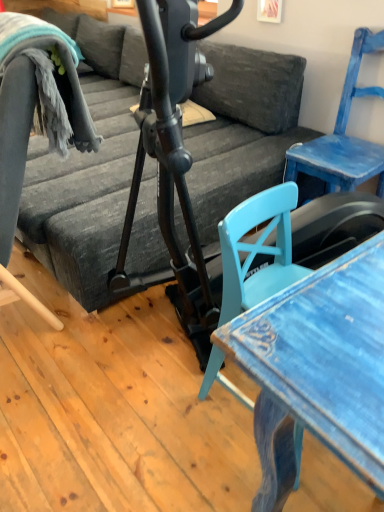
Question: Does distressed blue table at lower right appear on the left side of dark gray fabric couch at center?

Choices:
 (A) yes
 (B) no

Answer: (B)

Question: From a real-world perspective, is distressed blue table at lower right physically above dark gray fabric couch at center?

Choices:
 (A) yes
 (B) no

Answer: (B)

Question: From the image's perspective, does distressed blue table at lower right appear higher than dark gray fabric couch at center?

Choices:
 (A) no
 (B) yes

Answer: (A)

Question: Does distressed blue table at lower right have a smaller size compared to dark gray fabric couch at center?

Choices:
 (A) no
 (B) yes

Answer: (B)

Question: Considering the relative sizes of distressed blue table at lower right and dark gray fabric couch at center in the image provided, is distressed blue table at lower right wider than dark gray fabric couch at center?

Choices:
 (A) no
 (B) yes

Answer: (A)

Question: Is blue painted wood chair at right in front of or behind dark gray fabric couch at center in the image?

Choices:
 (A) front
 (B) behind

Answer: (B)

Question: From a real-world perspective, relative to dark gray fabric couch at center, is blue painted wood chair at right vertically above or below?

Choices:
 (A) above
 (B) below

Answer: (A)

Question: Is blue painted wood chair at right taller or shorter than dark gray fabric couch at center?

Choices:
 (A) tall
 (B) short

Answer: (A)

Question: Looking at their shapes, would you say blue painted wood chair at right is wider or thinner than dark gray fabric couch at center?

Choices:
 (A) wide
 (B) thin

Answer: (B)

Question: Relative to distressed blue table at lower right, is blue painted wood chair at right in front or behind?

Choices:
 (A) front
 (B) behind

Answer: (B)

Question: In the image, is blue painted wood chair at right on the left side or the right side of distressed blue table at lower right?

Choices:
 (A) left
 (B) right

Answer: (B)

Question: Looking at the image, does blue painted wood chair at right seem bigger or smaller compared to distressed blue table at lower right?

Choices:
 (A) big
 (B) small

Answer: (A)

Question: Would you say blue painted wood chair at right is inside or outside distressed blue table at lower right?

Choices:
 (A) inside
 (B) outside

Answer: (B)

Question: Is distressed blue table at lower right spatially inside dark gray fabric couch at center, or outside of it?

Choices:
 (A) inside
 (B) outside

Answer: (B)

Question: Considering the relative positions of distressed blue table at lower right and dark gray fabric couch at center in the image provided, is distressed blue table at lower right to the left or to the right of dark gray fabric couch at center?

Choices:
 (A) left
 (B) right

Answer: (B)